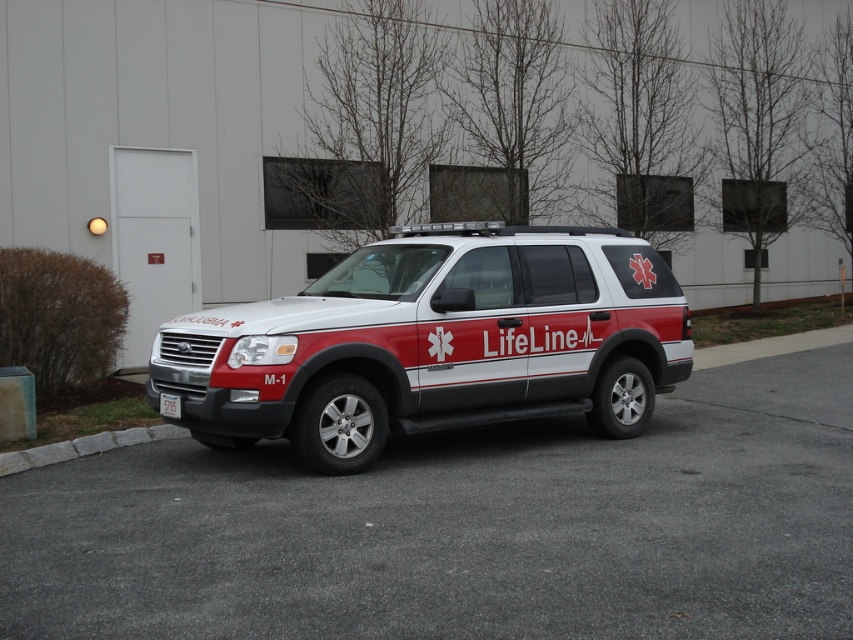
Question: Is white matte suv at center bigger than white plastic license plate at center?

Choices:
 (A) no
 (B) yes

Answer: (B)

Question: Does white matte suv at center appear over white plastic license plate at center?

Choices:
 (A) no
 (B) yes

Answer: (B)

Question: Can you confirm if white matte suv at center is positioned above white plastic license plate at center?

Choices:
 (A) yes
 (B) no

Answer: (A)

Question: Among these points, which one is nearest to the camera?

Choices:
 (A) (677, 307)
 (B) (161, 408)

Answer: (B)

Question: Among these objects, which one is farthest from the camera?

Choices:
 (A) white matte suv at center
 (B) white plastic license plate at center

Answer: (B)